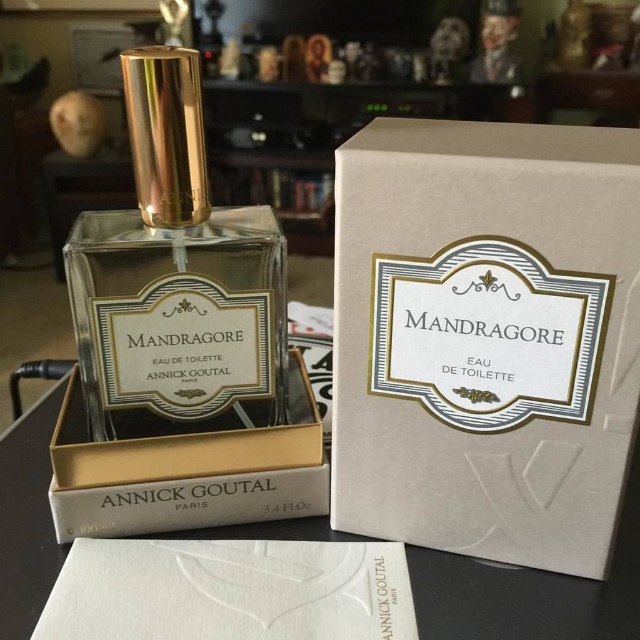
You are a customer looking at the perfume display. You want to pick up the matte glass perfume at center and the matte gold box at center. Which one do you need to move first to access the other?

You need to move the matte glass perfume at center first because it is closer to the viewer than the matte gold box at center. Once you move it, you can then access the matte gold box at center.